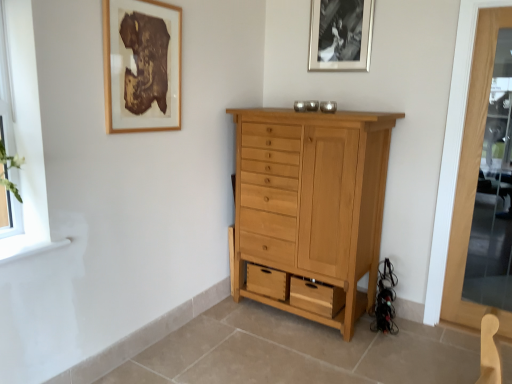
Question: Is wooden picture frame at upper left, the 1th picture frame when ordered from front to back, in contact with transparent glass screen door at right?

Choices:
 (A) no
 (B) yes

Answer: (A)

Question: Can you confirm if wooden picture frame at upper left, which appears as the 2th picture frame when viewed from the back, is smaller than transparent glass screen door at right?

Choices:
 (A) yes
 (B) no

Answer: (A)

Question: From the image's perspective, does wooden picture frame at upper left, placed as the 2th picture frame when sorted from right to left, appear higher than transparent glass screen door at right?

Choices:
 (A) no
 (B) yes

Answer: (B)

Question: From a real-world perspective, is wooden picture frame at upper left, the 1th picture frame when ordered from front to back, below transparent glass screen door at right?

Choices:
 (A) no
 (B) yes

Answer: (A)

Question: Is wooden picture frame at upper left, positioned as the 1th picture frame in left-to-right order, positioned beyond the bounds of transparent glass screen door at right?

Choices:
 (A) no
 (B) yes

Answer: (B)

Question: Is point (444, 147) positioned closer to the camera than point (10, 120)?

Choices:
 (A) closer
 (B) farther

Answer: (B)

Question: Is transparent glass screen door at right to the left or to the right of clear glass window at left in the image?

Choices:
 (A) left
 (B) right

Answer: (B)

Question: Do you think transparent glass screen door at right is within clear glass window at left, or outside of it?

Choices:
 (A) outside
 (B) inside

Answer: (A)

Question: From the image's perspective, is transparent glass screen door at right located above or below clear glass window at left?

Choices:
 (A) above
 (B) below

Answer: (B)

Question: Is transparent glass screen door at right bigger or smaller than black matte picture frame at upper center, which appears as the 2th picture frame when viewed from the front?

Choices:
 (A) small
 (B) big

Answer: (B)

Question: From the image's perspective, relative to black matte picture frame at upper center, which is the 1th picture frame in back-to-front order, is transparent glass screen door at right above or below?

Choices:
 (A) below
 (B) above

Answer: (A)

Question: Would you say transparent glass screen door at right is to the left or to the right of black matte picture frame at upper center, which appears as the 2th picture frame when viewed from the front, in the picture?

Choices:
 (A) right
 (B) left

Answer: (A)

Question: Do you think transparent glass screen door at right is within black matte picture frame at upper center, which is the 1th picture frame in back-to-front order, or outside of it?

Choices:
 (A) inside
 (B) outside

Answer: (B)

Question: Considering the relative positions of black matte picture frame at upper center, which appears as the 2th picture frame when viewed from the front, and transparent glass screen door at right in the image provided, is black matte picture frame at upper center, which appears as the 2th picture frame when viewed from the front, to the left or to the right of transparent glass screen door at right?

Choices:
 (A) right
 (B) left

Answer: (B)

Question: From a real-world perspective, is black matte picture frame at upper center, which appears as the 2th picture frame when viewed from the front, above or below transparent glass screen door at right?

Choices:
 (A) below
 (B) above

Answer: (B)